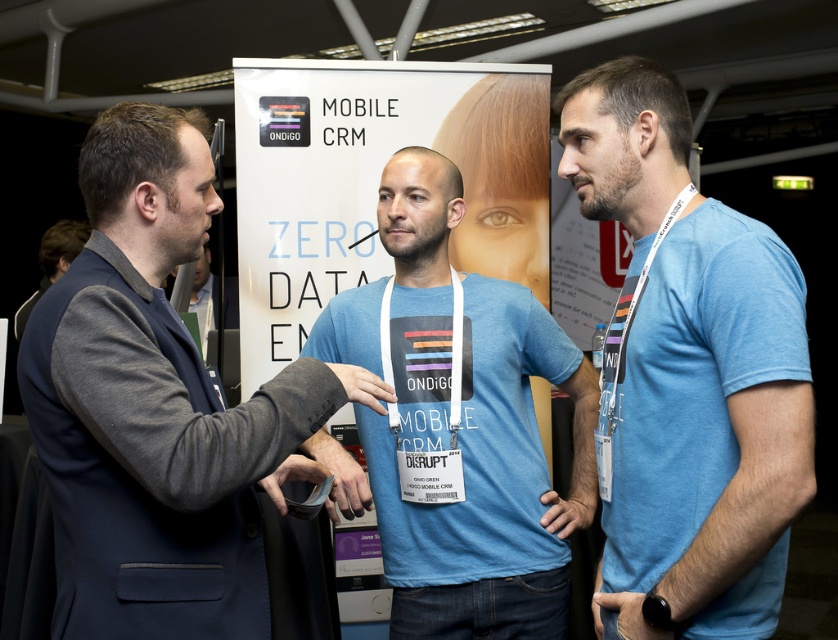
You are at a tech event and need to locate the registration desk. The registration desk is at the point with coordinates (339, 476). You see a matte black wristband at center. Is the registration desk near the matte black wristband at center?

Yes, the registration desk is at point (339, 476) where the matte black wristband at center is located, so they are near each other.